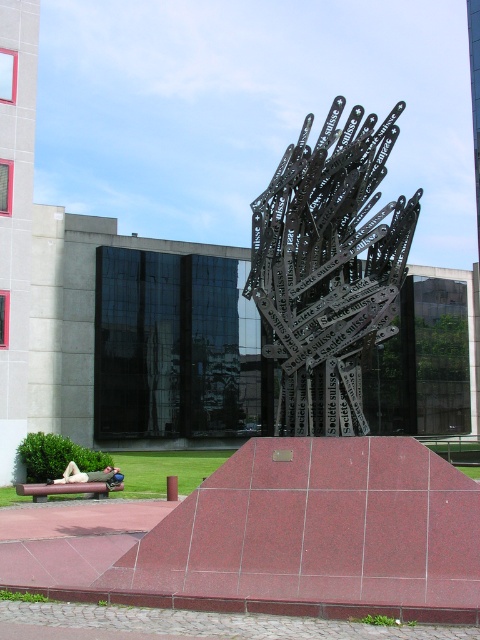
You are an artist planning to install a new sculpture in the same space as the existing one. You have a sculpture that is 2 meters wide. The existing sculpture has metallic chainsaw blades at center and light beige fabric at lower left. Can you place your new sculpture between these two objects without overlapping them?

The metallic chainsaw blades at center are to the right of the light beige fabric at lower left. Since the distance between them isn not specified, it is impossible to determine if the 2 meter wide sculpture will fit without overlapping.

Based on the photo, you are an artist planning to install a new sculpture in the same space. You have a sculpture that is 1.2 meters wide. Can the space between the metallic chainsaw blades at center and the light beige fabric at lower left accommodate your sculpture?

The metallic chainsaw blades at center might be wider than light beige fabric at lower left, but without exact measurements, it is uncertain if the space between them can accommodate a 1.2 meter wide sculpture. Further measurements are needed.